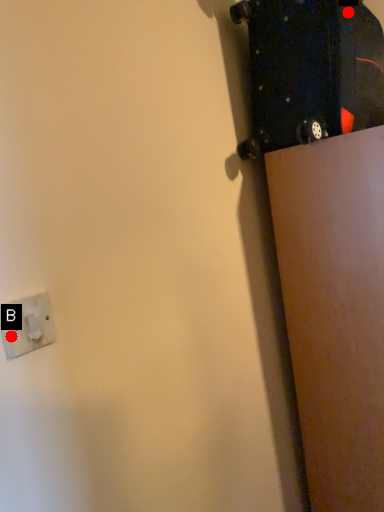
Question: Two points are circled on the image, labeled by A and B beside each circle. Among these points, which one is farthest from the camera?

Choices:
 (A) A is further
 (B) B is further

Answer: (A)